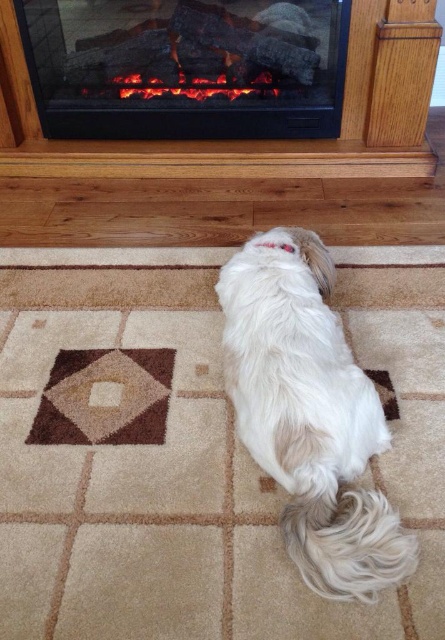
You are standing in the living room looking at the fireplace and the fluffy white dog. There are two points marked in the scene. Which point is closer to you, point [191,20] or point [250,296]?

Point [191,20] is further to the camera than point [250,296], so the closer point to you is point [250,296].

Consider the image. You are standing in the room and want to place a new painting exactly where the black electric fireplace at upper center is currently located. What coordinates should you mark on the wall to place the painting?

You should mark the coordinates at point (186, 67) on the wall to place the painting where the black electric fireplace at upper center is located.

You are a guest in this living room and want to place a small decorative item on the carpet near the white fluffy dog at center. Considering the position of the black electric fireplace at upper center, where should you place the item to avoid blocking the dog from the fireplace?

The black electric fireplace at upper center is positioned over the white fluffy dog at center, so placing the item between the dog and the fireplace might block the dog from the fireplace. To avoid this, place the item either to the side of the dog or behind it, away from the direct line of sight between the dog and the fireplace.